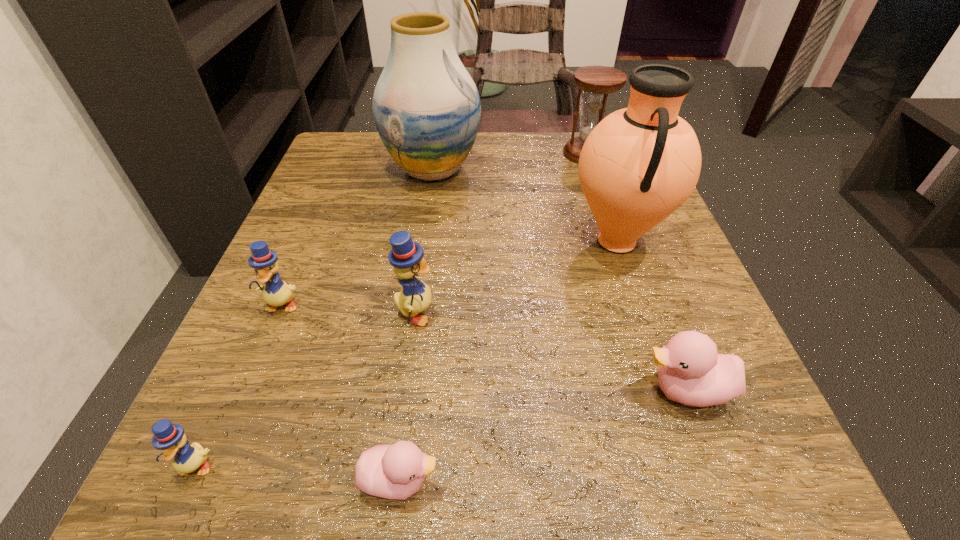
Where is `vacant area at the near edge`? Image resolution: width=960 pixels, height=540 pixels. vacant area at the near edge is located at coordinates (529, 487).

In the image, there is a desktop. Where is `vacant space at the left edge`? vacant space at the left edge is located at coordinates [315, 222].

Identify the location of vacant region at the right edge of the desktop. (701, 284).

Locate an element on the screen. The height and width of the screenshot is (540, 960). vacant space at the far left corner of the desktop is located at coordinates (350, 161).

The image size is (960, 540). What are the coordinates of `empty space that is in between the vase and the rightmost yellow duckling` in the screenshot? It's located at (424, 241).

Identify the location of blank region between the nearer pink duckling and the pitcher. This screenshot has height=540, width=960. (508, 361).

The width and height of the screenshot is (960, 540). Find the location of `vacant area that lies between the sixth nearest object and the vase`. vacant area that lies between the sixth nearest object and the vase is located at coordinates (524, 205).

Locate an element on the screen. The image size is (960, 540). vacant region between the right pink duckling and the hourglass is located at coordinates (636, 272).

Locate an element on the screen. The height and width of the screenshot is (540, 960). free area in between the smallest yellow duckling and the rightmost duckling is located at coordinates (441, 428).

Where is `free point between the vase and the second biggest yellow duckling`? The width and height of the screenshot is (960, 540). free point between the vase and the second biggest yellow duckling is located at coordinates [x=357, y=237].